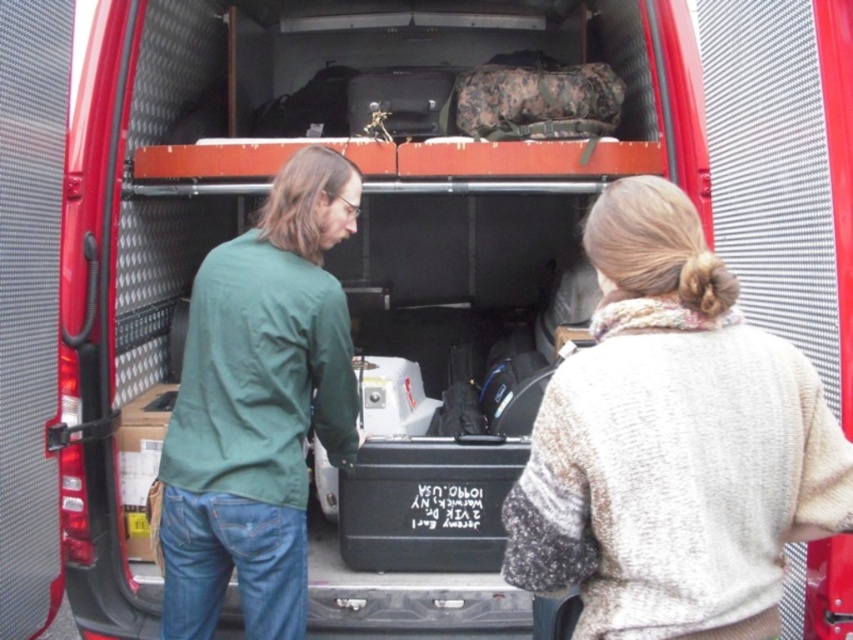
Question: Among these points, which one is nearest to the camera?

Choices:
 (A) (161, 560)
 (B) (316, 234)
 (C) (613, 280)

Answer: (C)

Question: Observing the image, what is the correct spatial positioning of knitted beige sweater at center in reference to green matte shirt at center?

Choices:
 (A) left
 (B) right

Answer: (B)

Question: Which object is positioned farthest from the green matte shirt at center?

Choices:
 (A) green matte jacket at center
 (B) knitted beige sweater at center

Answer: (B)

Question: Can you confirm if knitted beige sweater at center is positioned above green matte jacket at center?

Choices:
 (A) no
 (B) yes

Answer: (B)

Question: Which point appears farthest from the camera in this image?

Choices:
 (A) click(310, 157)
 (B) click(241, 490)
 (C) click(589, 385)

Answer: (A)

Question: Does green matte shirt at center appear on the left side of green matte jacket at center?

Choices:
 (A) yes
 (B) no

Answer: (B)